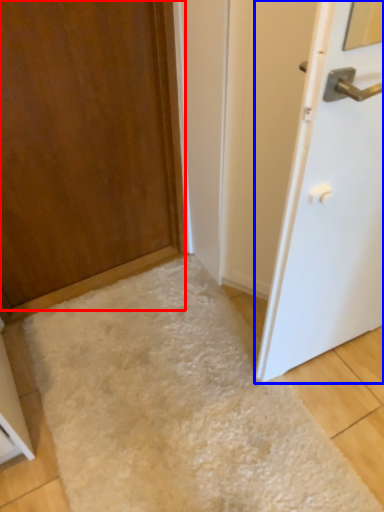
Question: Which object appears farthest to the camera in this image, door (highlighted by a red box) or door (highlighted by a blue box)?

Choices:
 (A) door
 (B) door

Answer: (A)